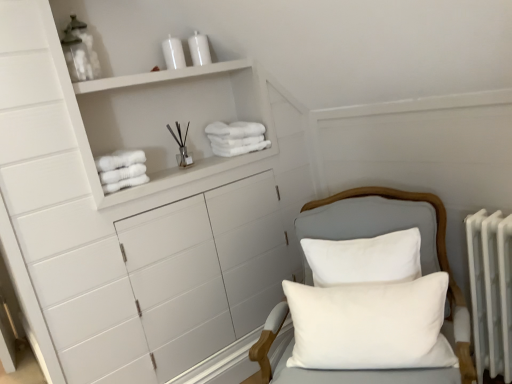
Question: Considering the positions of white soft towel at upper center, placed as the 2th bath towel when sorted from front to back, and white fluffy towels at upper left, which appears as the 2th bath towel when viewed from the top, in the image, is white soft towel at upper center, placed as the 2th bath towel when sorted from front to back, taller or shorter than white fluffy towels at upper left, which appears as the 2th bath towel when viewed from the top,?

Choices:
 (A) short
 (B) tall

Answer: (B)

Question: Does point (260, 145) appear closer or farther from the camera than point (116, 152)?

Choices:
 (A) farther
 (B) closer

Answer: (A)

Question: Based on their relative distances, which object is nearer to the white matte cabinet at upper left?

Choices:
 (A) white fluffy towels at upper left, which appears as the 2th bath towel when viewed from the top
 (B) white soft towel at upper center, the 2th bath towel from the left
 (C) white soft pillow at center, which ranks as the first pillow in bottom-to-top order
 (D) white fabric chair at center
 (E) white soft pillow at center, placed as the 2th pillow when sorted from bottom to top

Answer: (B)

Question: Estimate the real-world distances between objects in this image. Which object is farther from the white soft pillow at center, arranged as the second pillow when viewed from the top?

Choices:
 (A) white fabric chair at center
 (B) white matte cabinet at upper left
 (C) white soft towel at upper center, placed as the 2th bath towel when sorted from front to back
 (D) white fluffy towels at upper left, the first bath towel in the bottom-to-top sequence
 (E) white soft pillow at center, marked as the first pillow in a top-to-bottom arrangement

Answer: (D)